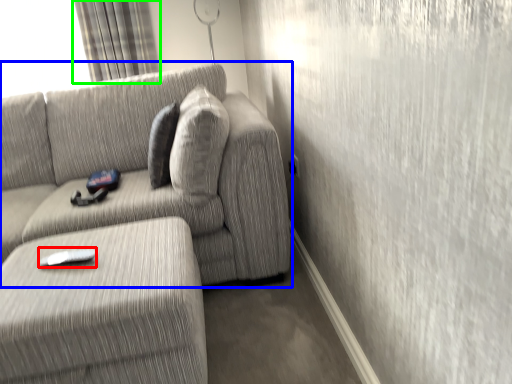
Question: Which object is positioned farthest from remote (highlighted by a red box)? Select from studio couch (highlighted by a blue box) and curtain (highlighted by a green box).

Choices:
 (A) studio couch
 (B) curtain

Answer: (B)